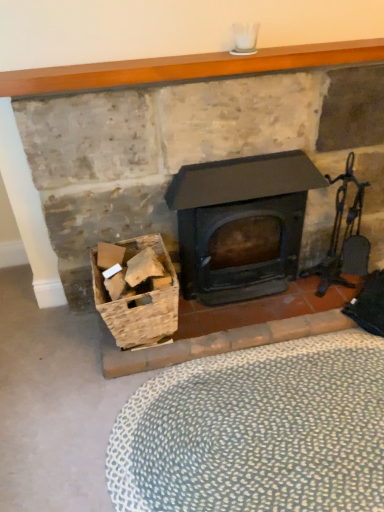
Question: Should I look upward or downward to see matte black wood burning stove at center?

Choices:
 (A) down
 (B) up

Answer: (B)

Question: Is metallic dark brown fireplace tool set at right oriented away from smooth wooden mantle at upper center?

Choices:
 (A) no
 (B) yes

Answer: (A)

Question: Is metallic dark brown fireplace tool set at right far away from smooth wooden mantle at upper center?

Choices:
 (A) no
 (B) yes

Answer: (A)

Question: Is metallic dark brown fireplace tool set at right located outside smooth wooden mantle at upper center?

Choices:
 (A) no
 (B) yes

Answer: (B)

Question: Is metallic dark brown fireplace tool set at right aimed at smooth wooden mantle at upper center?

Choices:
 (A) no
 (B) yes

Answer: (A)

Question: Does metallic dark brown fireplace tool set at right contain smooth wooden mantle at upper center?

Choices:
 (A) yes
 (B) no

Answer: (B)

Question: Can you confirm if metallic dark brown fireplace tool set at right is taller than smooth wooden mantle at upper center?

Choices:
 (A) no
 (B) yes

Answer: (B)

Question: Is matte black stove at center outside of metallic dark brown fireplace tool set at right?

Choices:
 (A) no
 (B) yes

Answer: (B)

Question: Does matte black stove at center have a smaller size compared to metallic dark brown fireplace tool set at right?

Choices:
 (A) yes
 (B) no

Answer: (B)

Question: Considering the relative sizes of matte black stove at center and metallic dark brown fireplace tool set at right in the image provided, is matte black stove at center taller than metallic dark brown fireplace tool set at right?

Choices:
 (A) no
 (B) yes

Answer: (B)

Question: From a real-world perspective, is matte black stove at center located higher than metallic dark brown fireplace tool set at right?

Choices:
 (A) yes
 (B) no

Answer: (A)

Question: From a real-world perspective, does matte black stove at center sit lower than metallic dark brown fireplace tool set at right?

Choices:
 (A) yes
 (B) no

Answer: (B)

Question: Is matte black stove at center shorter than metallic dark brown fireplace tool set at right?

Choices:
 (A) yes
 (B) no

Answer: (B)

Question: Can you confirm if matte black wood burning stove at center is positioned to the right of smooth wooden mantle at upper center?

Choices:
 (A) no
 (B) yes

Answer: (B)